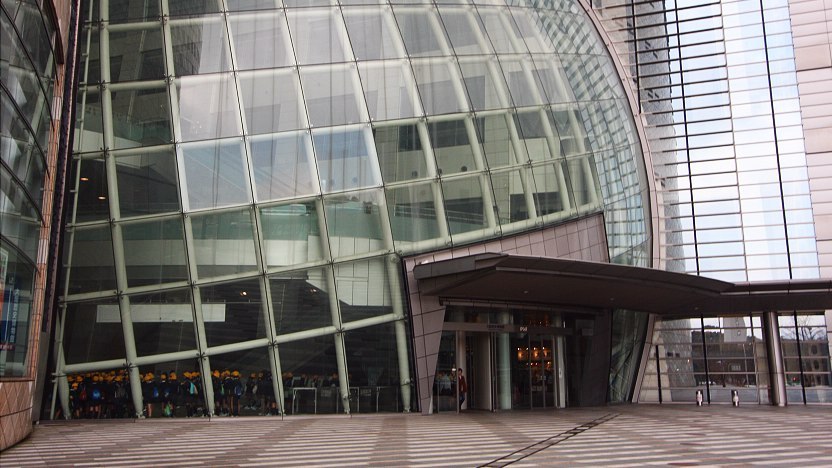
Image resolution: width=832 pixels, height=468 pixels. Find the location of `red bricks on floor`. red bricks on floor is located at coordinates (555, 460), (404, 445).